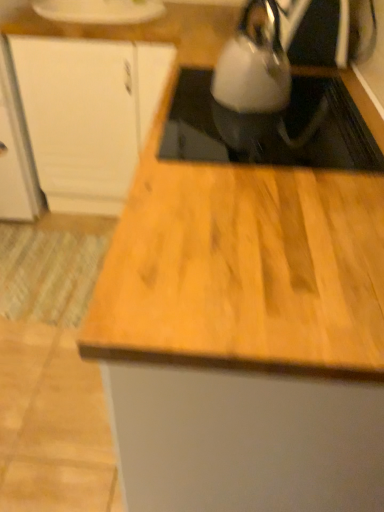
Question: Is satin silver kettle at upper right positioned with its back to white glossy kettle at upper center?

Choices:
 (A) yes
 (B) no

Answer: (B)

Question: Can you confirm if satin silver kettle at upper right is positioned to the right of white glossy kettle at upper center?

Choices:
 (A) no
 (B) yes

Answer: (A)

Question: Considering the relative sizes of satin silver kettle at upper right and white glossy kettle at upper center in the image provided, is satin silver kettle at upper right wider than white glossy kettle at upper center?

Choices:
 (A) no
 (B) yes

Answer: (A)

Question: Can you confirm if satin silver kettle at upper right is shorter than white glossy kettle at upper center?

Choices:
 (A) no
 (B) yes

Answer: (A)

Question: Is white glossy kettle at upper center located within satin silver kettle at upper right?

Choices:
 (A) no
 (B) yes

Answer: (A)

Question: Is satin silver kettle at upper right with white glossy kettle at upper center?

Choices:
 (A) no
 (B) yes

Answer: (A)

Question: Considering the relative positions of satin silver kettle at upper right and white matte cabinet at upper left in the image provided, is satin silver kettle at upper right in front of white matte cabinet at upper left?

Choices:
 (A) no
 (B) yes

Answer: (B)

Question: Is satin silver kettle at upper right shorter than white matte cabinet at upper left?

Choices:
 (A) yes
 (B) no

Answer: (A)

Question: Considering the relative positions of satin silver kettle at upper right and white matte cabinet at upper left in the image provided, is satin silver kettle at upper right to the left of white matte cabinet at upper left from the viewer's perspective?

Choices:
 (A) yes
 (B) no

Answer: (B)

Question: Considering the relative sizes of satin silver kettle at upper right and white matte cabinet at upper left in the image provided, is satin silver kettle at upper right taller than white matte cabinet at upper left?

Choices:
 (A) yes
 (B) no

Answer: (B)

Question: Is satin silver kettle at upper right outside of white matte cabinet at upper left?

Choices:
 (A) no
 (B) yes

Answer: (B)

Question: Can you confirm if satin silver kettle at upper right is positioned to the right of white matte cabinet at upper left?

Choices:
 (A) yes
 (B) no

Answer: (A)

Question: Is the position of white glossy kettle at upper center less distant than that of white matte cabinet at upper left?

Choices:
 (A) no
 (B) yes

Answer: (B)